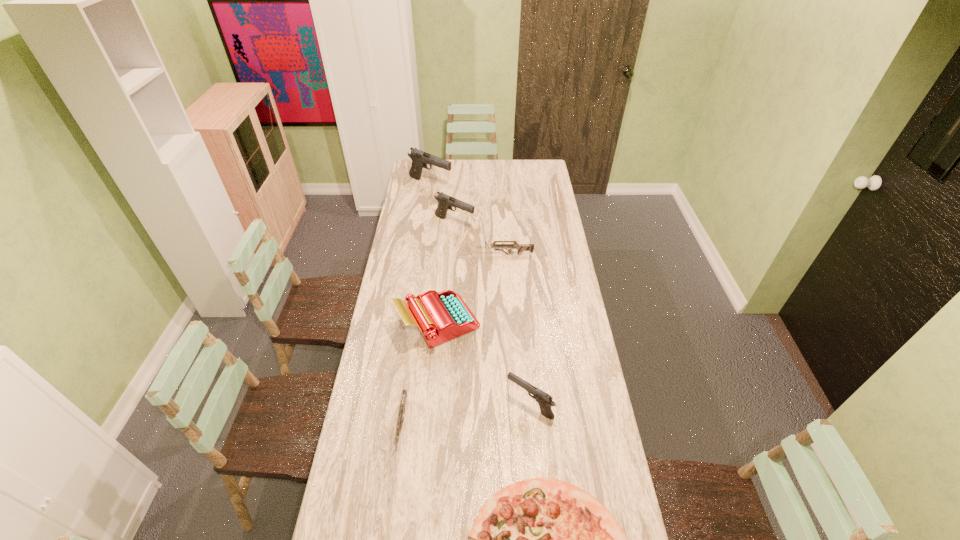
This screenshot has height=540, width=960. I want to click on free space located aimed along the barrel of the shortest gun, so click(389, 523).

Locate an element on the screen. The image size is (960, 540). object situated at the far edge is located at coordinates (420, 159).

The image size is (960, 540). Find the location of `typewriter positioned at the left edge`. typewriter positioned at the left edge is located at coordinates (441, 316).

At what (x,y) coordinates should I click in order to perform the action: click on object that is at the far left corner. Please return your answer as a coordinate pair (x, y). Looking at the image, I should click on (420, 159).

In the image, there is a desktop. Identify the location of vacant space at the far edge. (456, 171).

Identify the location of vacant space at the left edge of the desktop. (398, 255).

This screenshot has width=960, height=540. What are the coordinates of `free point at the right edge` in the screenshot? It's located at (555, 291).

Find the location of a particular element. The height and width of the screenshot is (540, 960). empty space between the farthest black gun and the third shortest gun is located at coordinates (480, 294).

Identify the location of empty location between the shortest gun and the fourth nearest object. This screenshot has height=540, width=960. (420, 374).

Locate an element on the screen. This screenshot has width=960, height=540. vacant area that lies between the second farthest gun and the nearest black gun is located at coordinates (492, 314).